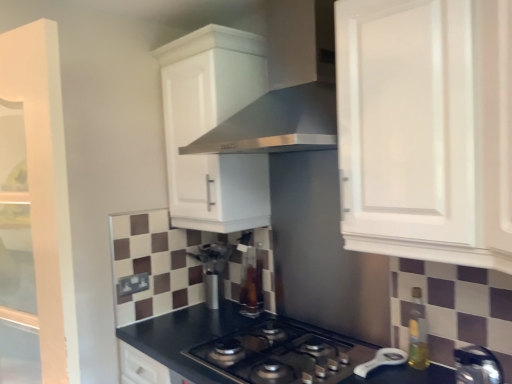
Question: Is metallic silver kettle at lower right, which is the first appliance from front to back, closer to camera compared to satin silver vent at upper center?

Choices:
 (A) yes
 (B) no

Answer: (A)

Question: Is metallic silver kettle at lower right, the 2th appliance when ordered from left to right, next to satin silver vent at upper center?

Choices:
 (A) no
 (B) yes

Answer: (A)

Question: Could you tell me if metallic silver kettle at lower right, the 1th appliance from the right, is turned towards satin silver vent at upper center?

Choices:
 (A) no
 (B) yes

Answer: (A)

Question: Does metallic silver kettle at lower right, the 1th appliance from the right, have a larger size compared to satin silver vent at upper center?

Choices:
 (A) no
 (B) yes

Answer: (A)

Question: From a real-world perspective, does metallic silver kettle at lower right, marked as the 2th appliance in a back-to-front arrangement, stand above satin silver vent at upper center?

Choices:
 (A) no
 (B) yes

Answer: (A)

Question: From the image's perspective, is translucent amber bottle at right located above or below satin silver vent at upper center?

Choices:
 (A) above
 (B) below

Answer: (B)

Question: Considering the relative positions of translucent amber bottle at right and satin silver vent at upper center in the image provided, is translucent amber bottle at right to the left or to the right of satin silver vent at upper center?

Choices:
 (A) left
 (B) right

Answer: (B)

Question: Considering their positions, is translucent amber bottle at right located in front of or behind satin silver vent at upper center?

Choices:
 (A) behind
 (B) front

Answer: (A)

Question: From a real-world perspective, is translucent amber bottle at right physically located above or below satin silver vent at upper center?

Choices:
 (A) above
 (B) below

Answer: (B)

Question: Is satin silver coffee machine at center inside or outside of transparent glass bottle at center, the first appliance when ordered from back to front?

Choices:
 (A) inside
 (B) outside

Answer: (B)

Question: From a real-world perspective, relative to transparent glass bottle at center, marked as the first appliance in a left-to-right arrangement, is satin silver coffee machine at center vertically above or below?

Choices:
 (A) below
 (B) above

Answer: (A)

Question: Is satin silver coffee machine at center in front of or behind transparent glass bottle at center, which is the 2th appliance from right to left, in the image?

Choices:
 (A) front
 (B) behind

Answer: (B)

Question: Considering the relative positions of satin silver coffee machine at center and transparent glass bottle at center, marked as the first appliance in a left-to-right arrangement, in the image provided, is satin silver coffee machine at center to the left or to the right of transparent glass bottle at center, marked as the first appliance in a left-to-right arrangement,?

Choices:
 (A) left
 (B) right

Answer: (A)

Question: From the image's perspective, relative to black matte gas stove at center, is satin silver vent at upper center above or below?

Choices:
 (A) above
 (B) below

Answer: (A)

Question: Is point (272, 102) closer or farther from the camera than point (283, 360)?

Choices:
 (A) farther
 (B) closer

Answer: (A)